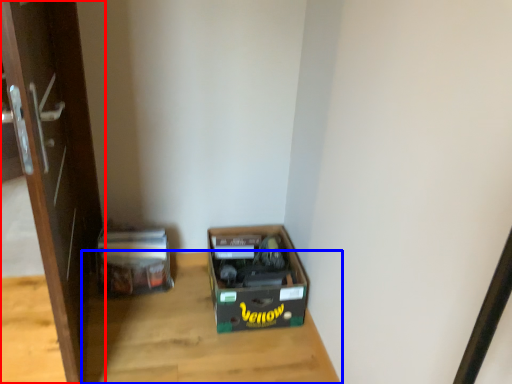
Question: Which object is closer to the camera taking this photo, door (highlighted by a red box) or table (highlighted by a blue box)?

Choices:
 (A) door
 (B) table

Answer: (A)